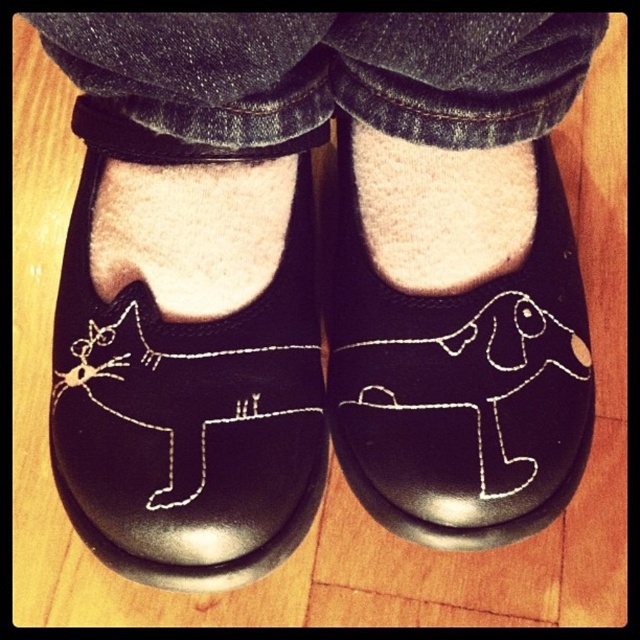
You are standing in a room with wooden floors and want to place a small potted plant exactly 4 feet away from the point at coordinates point (x=241, y=324). Can you confirm if placing the plant at your current position will achieve this?

The distance between point (x=241, y=324) and the viewer is 3.95 feet. Placing the plant at your current position would be slightly closer than 4 feet, so it won not reach the desired distance.

You are a shoemaker who wants to place a new design on the black leather cat at center and black leather dog at center. The new design requires a minimum of 30 centimeters between the two existing designs. Can you determine if there is enough space between them?

The black leather cat at center and black leather dog at center are 25.96 centimeters apart from each other. Since the required minimum space is 30 centimeters, there is not enough space between them for the new design.

You are standing in a room with wooden floors and want to place a small potted plant exactly at the point marked as point (493, 387). If you are currently 3.86 feet away from that point, how many steps do you need to take to reach it assuming each step covers about 2.5 feet?

Since the distance to point (493, 387) is 3.86 feet and each step covers 2.5 feet, you would need to take 2 steps to reach it. After two steps, you would have covered 5 feet, which is slightly past the point, so you might need to adjust your last step to land precisely at the point.